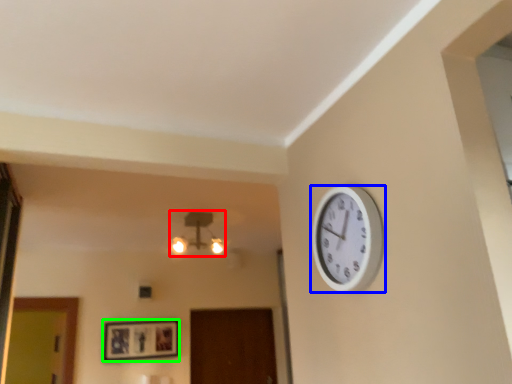
Question: Which is farther away from lamp (highlighted by a red box)? wall clock (highlighted by a blue box) or picture frame (highlighted by a green box)?

Choices:
 (A) wall clock
 (B) picture frame

Answer: (A)